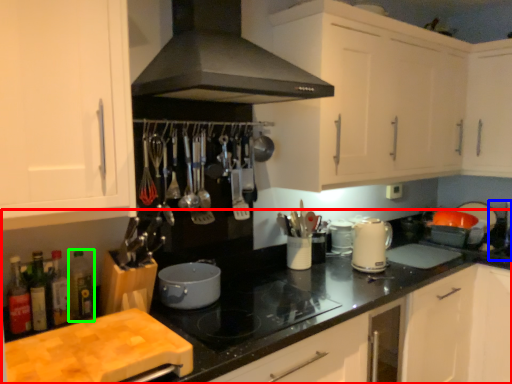
Question: Considering the real-world distances, which object is farthest from cabinetry (highlighted by a red box)? sink (highlighted by a blue box) or bottle (highlighted by a green box)?

Choices:
 (A) sink
 (B) bottle

Answer: (A)